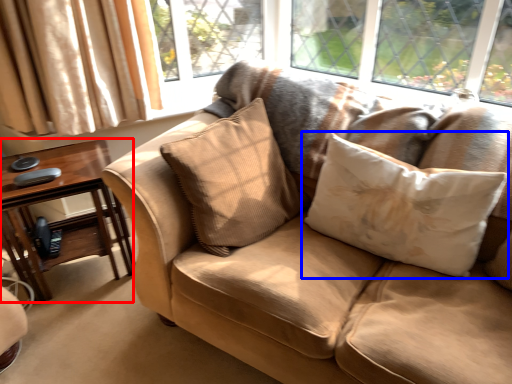
Question: Which of the following is the farthest to the observer, table (highlighted by a red box) or pillow (highlighted by a blue box)?

Choices:
 (A) table
 (B) pillow

Answer: (A)